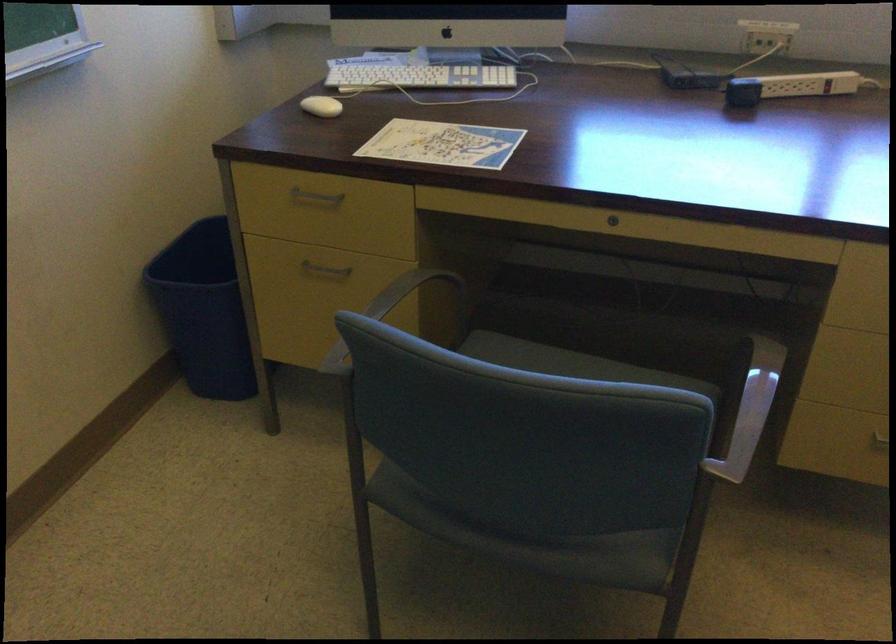
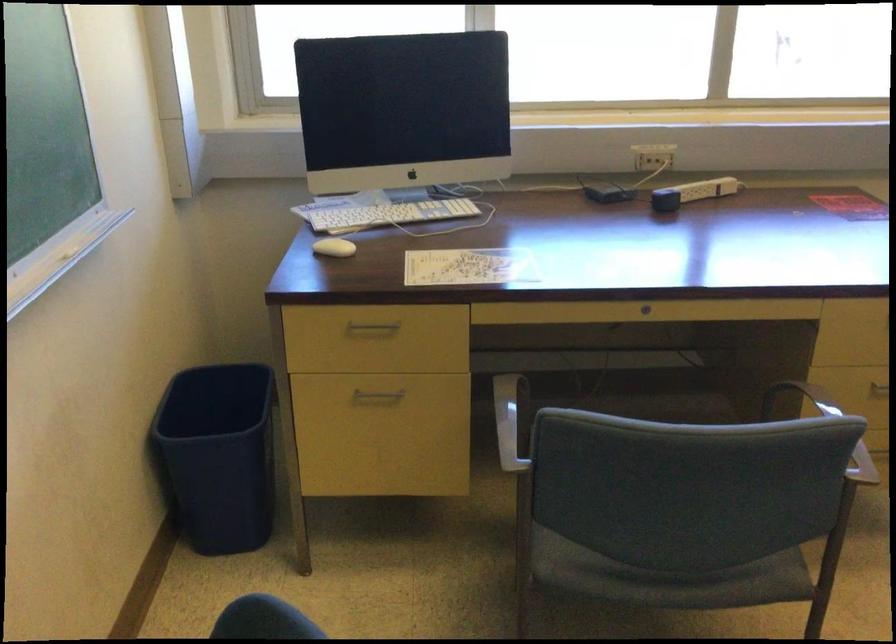
In the second image, find the point that corresponds to point (315, 108) in the first image.

(333, 247)